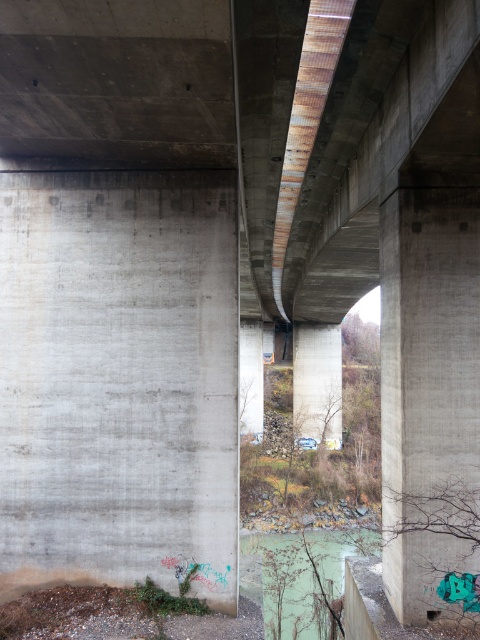
Question: Which point is farther from the camera taking this photo?

Choices:
 (A) (300, 403)
 (B) (252, 323)
 (C) (468, 435)
 (D) (28, 490)

Answer: (B)

Question: In this image, where is concrete/rough pillar at right located relative to rusty metal pillar at center?

Choices:
 (A) left
 (B) right

Answer: (A)

Question: Which of the following is the farthest from the observer?

Choices:
 (A) (325, 403)
 (B) (58, 195)
 (C) (240, 380)
 (D) (444, 356)

Answer: (A)

Question: Which object is the farthest from the gray concrete wall at left?

Choices:
 (A) concrete/rough pillar at right
 (B) rusty metal pillar at center

Answer: (B)

Question: Does concrete/rough pillar at right lie in front of rusty metal pillar at center?

Choices:
 (A) no
 (B) yes

Answer: (B)

Question: Can you confirm if rusty metal pillar at center is positioned to the right of gray concrete pillar at center?

Choices:
 (A) yes
 (B) no

Answer: (A)